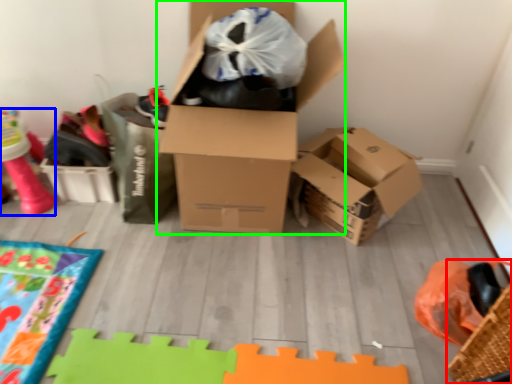
Question: Considering the real-world distances, which object is closest to basket (highlighted by a red box)? toy (highlighted by a blue box) or box (highlighted by a green box).

Choices:
 (A) toy
 (B) box

Answer: (B)